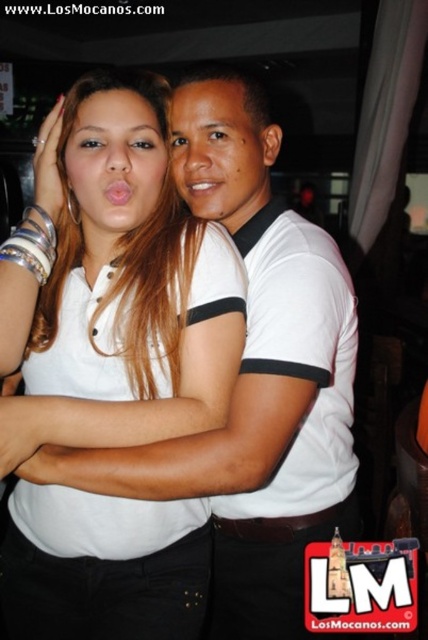
In the scene shown: You are a photographer at a social event and need to capture a photo of the two people wearing white shirts at the center. The camera you are using has a minimum focusing distance of 18 centimeters. Can you take a clear photo of both the white matte shirt at center and the white cotton shirt at center without moving the subjects?

The white matte shirt at center and white cotton shirt at center are 18.29 centimeters apart. Since the minimum focusing distance is 18 centimeters, the camera can focus on both shirts as the distance between them is slightly more than the required minimum. Therefore, a clear photo of both the white matte shirt at center and the white cotton shirt at center can be taken without moving the subjects.

You are standing in the room where the two people are posing. You need to locate the white matte shirt at center. Based on the coordinates given, where would you look to find it?

The white matte shirt at center is located at coordinates point (115,284).

You are a photographer at an event and need to ensure both subjects are visible in the photo. Since both are wearing white shirts, will the white matte shirt at center and the white cotton shirt at center be distinguishable in the final image?

The white matte shirt at center is in front of the white cotton shirt at center, so the one in front will block part of the one behind, making them partially distinguishable depending on the overlap.